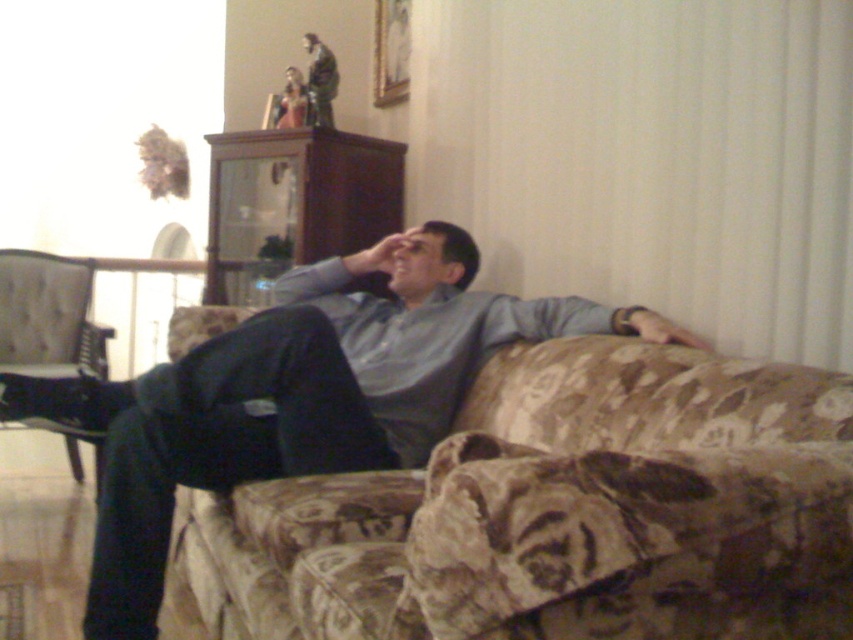
You are standing in the living room and want to place a small decorative item on the sofa. The sofa has a floral pattern in muted tones. Where on the sofa should you place the item to ensure it is centered exactly at point (296, 396)?

The point (296, 396) on the sofa is where the matte gray shirt at center is located. Since the shirt is already there, placing the item at that point would place it directly on the shirt.

Where is the matte gray shirt at center located in the image?

The matte gray shirt at center is located at point (296, 396) in the image.